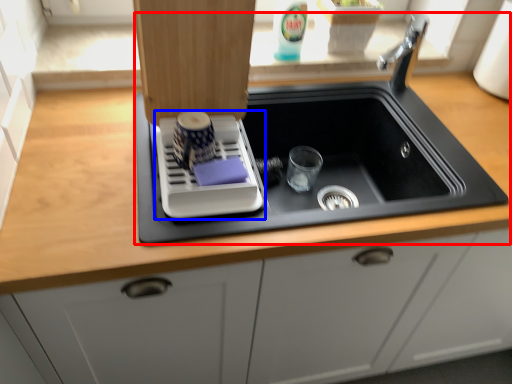
Question: Among these objects, which one is farthest to the camera, sink (highlighted by a red box) or appliance (highlighted by a blue box)?

Choices:
 (A) sink
 (B) appliance

Answer: (A)